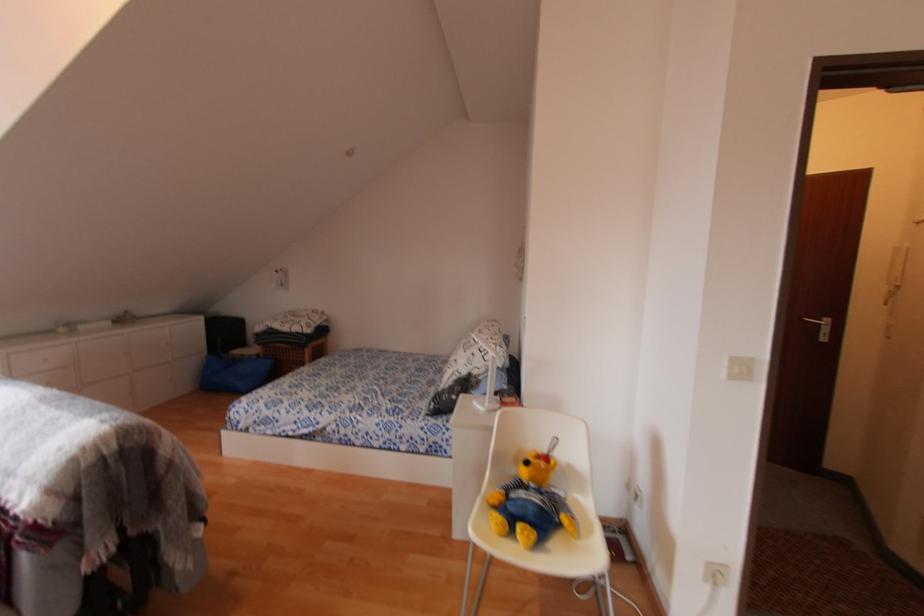
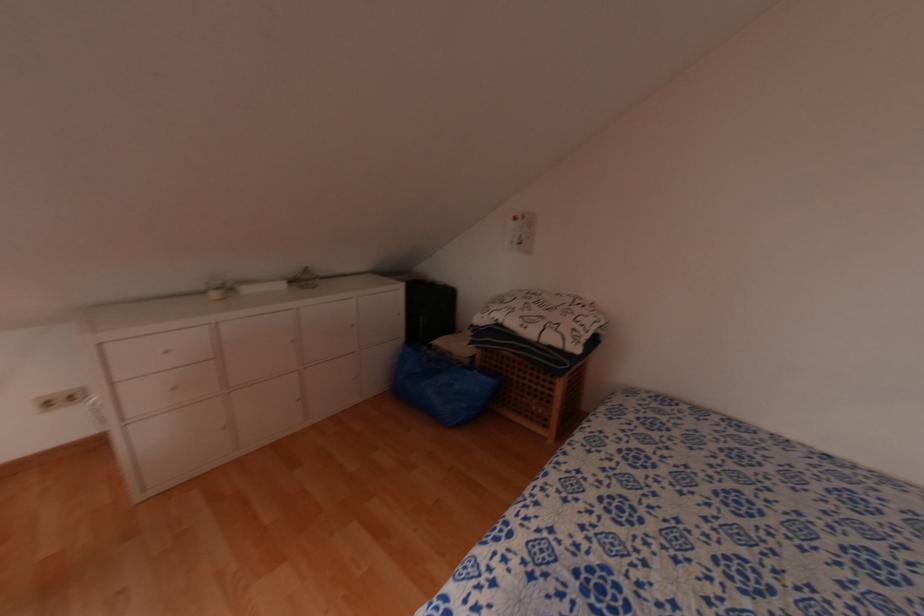
Locate, in the second image, the point that corresponds to pixel 304 355 in the first image.

(552, 384)